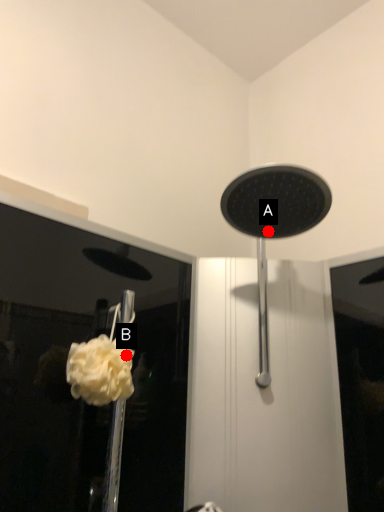
Question: Two points are circled on the image, labeled by A and B beside each circle. Which point is farther from the camera taking this photo?

Choices:
 (A) A is further
 (B) B is further

Answer: (A)